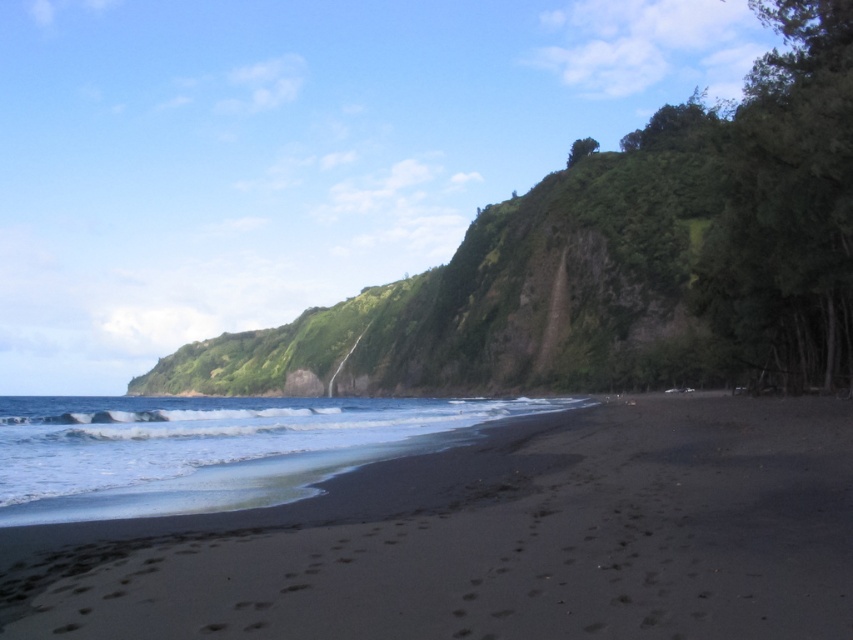
Question: Does black sand at lower center lie in front of clear water at lower left?

Choices:
 (A) no
 (B) yes

Answer: (B)

Question: Is black sand at lower center to the left of clear water at lower left from the viewer's perspective?

Choices:
 (A) yes
 (B) no

Answer: (B)

Question: Which point appears farthest from the camera in this image?

Choices:
 (A) (194, 483)
 (B) (27, 545)

Answer: (A)

Question: Among these points, which one is farthest from the camera?

Choices:
 (A) (521, 474)
 (B) (169, 404)

Answer: (B)

Question: Where is black sand at lower center located in relation to clear water at lower left in the image?

Choices:
 (A) right
 (B) left

Answer: (A)